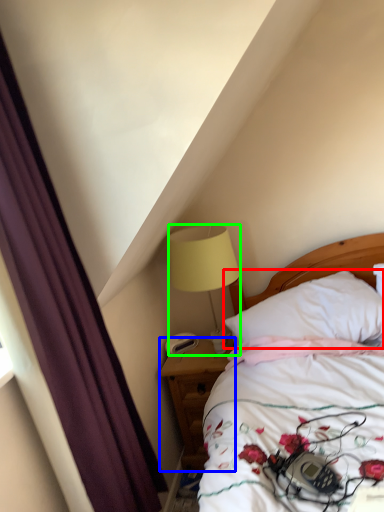
Question: Based on their relative distances, which object is nearer to pillow (highlighted by a red box)? Choose from nightstand (highlighted by a blue box) and lamp (highlighted by a green box).

Choices:
 (A) nightstand
 (B) lamp

Answer: (B)